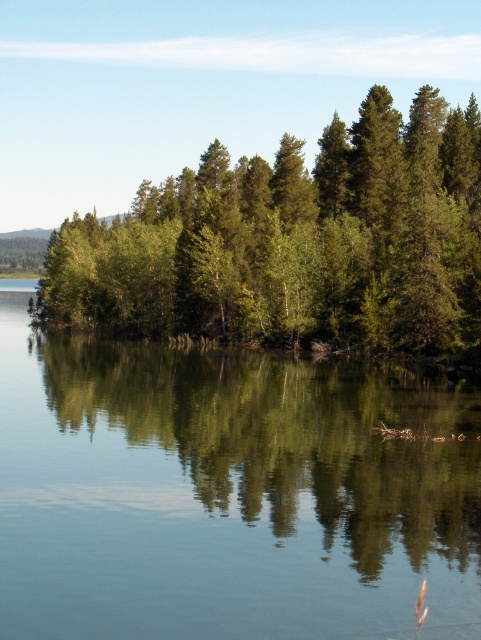
You are a photographer planning to capture the reflection of the green reflective water at center and the green matte trees at center in the image. Which object will appear shorter in the reflection compared to its actual size?

The green reflective water at center will appear shorter in the reflection compared to its actual size because it is not as tall as the green matte trees at center.

You are standing at the edge of the water in the serene natural landscape. You notice two points marked in the image. Which point, point (x=331, y=579) or point (x=144, y=232), is closer to you?

Point (x=331, y=579) is closer to the camera than point (x=144, y=232), so the point closer to you is point (x=331, y=579).

In the scene shown: You are an environmental scientist assessing the landscape. You need to determine which area is narrower between the green reflective water at center and the green matte trees at center. Which one is narrower?

The green reflective water at center has a lesser width compared to the green matte trees at center, so the green reflective water at center is narrower.